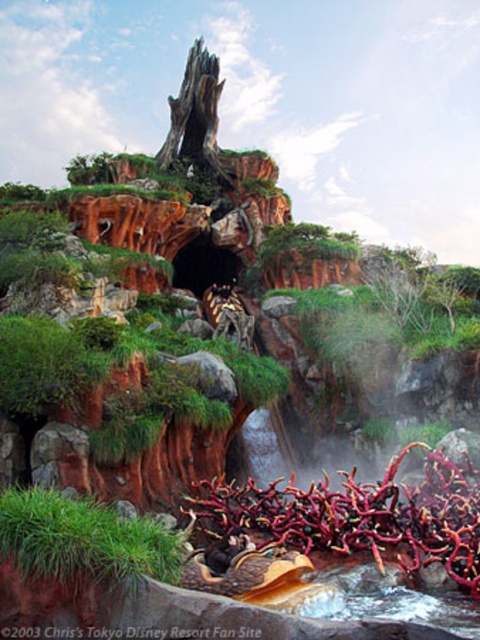
Question: Is rubberized red vines at lower center positioned in front of green grassy patch at lower left?

Choices:
 (A) yes
 (B) no

Answer: (B)

Question: Can you confirm if rubberized red vines at lower center is positioned above green grassy patch at lower left?

Choices:
 (A) no
 (B) yes

Answer: (A)

Question: Which point is farther to the camera?

Choices:
 (A) (141, 536)
 (B) (252, 525)

Answer: (B)

Question: Does rubberized red vines at lower center appear on the right side of green grassy patch at lower left?

Choices:
 (A) no
 (B) yes

Answer: (B)